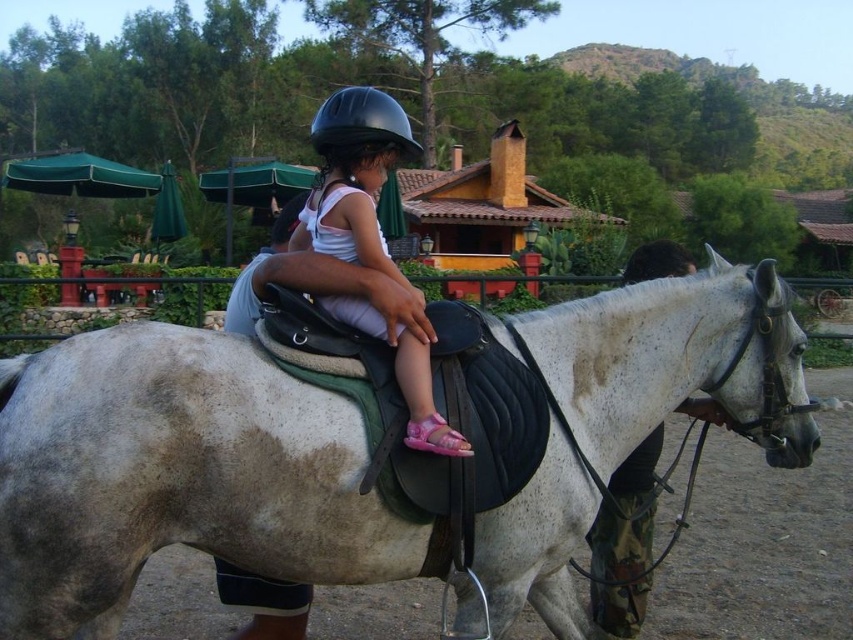
Question: Which object appears farthest from the camera in this image?

Choices:
 (A) black matte helmet at center
 (B) white matte horse at center
 (C) matte black helmet at center

Answer: (A)

Question: Among these points, which one is nearest to the camera?

Choices:
 (A) (341, 122)
 (B) (770, 429)
 (C) (311, 134)

Answer: (A)

Question: Does white matte horse at center have a smaller size compared to black matte helmet at center?

Choices:
 (A) yes
 (B) no

Answer: (A)

Question: Does matte black helmet at center have a lesser width compared to black matte helmet at center?

Choices:
 (A) yes
 (B) no

Answer: (A)

Question: Does matte black helmet at center lie in front of black matte helmet at center?

Choices:
 (A) yes
 (B) no

Answer: (A)

Question: Which is nearer to the black matte helmet at center?

Choices:
 (A) white matte horse at center
 (B) matte black helmet at center

Answer: (A)